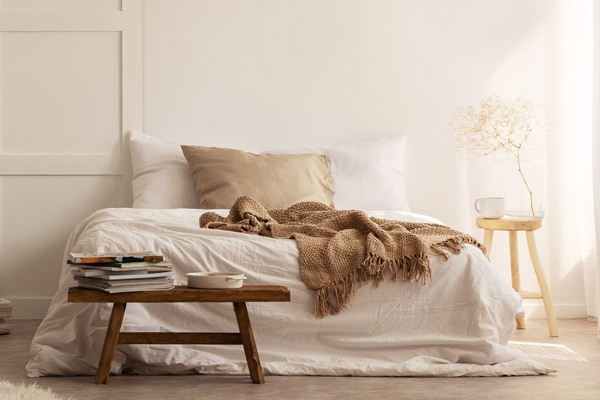
Locate an element on the screen. The width and height of the screenshot is (600, 400). book is located at coordinates (147, 280).